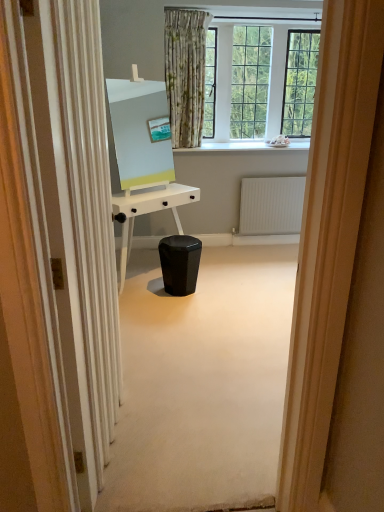
Question: Should I look upward or downward to see white textured radiator at center?

Choices:
 (A) down
 (B) up

Answer: (B)

Question: Is white textured radiator at center completely or partially outside of white glossy desk at center?

Choices:
 (A) no
 (B) yes

Answer: (B)

Question: From a real-world perspective, is white textured radiator at center physically above white glossy desk at center?

Choices:
 (A) yes
 (B) no

Answer: (B)

Question: Is white textured radiator at center facing away from white glossy desk at center?

Choices:
 (A) yes
 (B) no

Answer: (B)

Question: Is white textured radiator at center far from white glossy desk at center?

Choices:
 (A) yes
 (B) no

Answer: (A)

Question: Does white textured radiator at center appear on the right side of white glossy desk at center?

Choices:
 (A) yes
 (B) no

Answer: (A)

Question: Considering the relative sizes of white textured radiator at center and white glossy desk at center in the image provided, is white textured radiator at center smaller than white glossy desk at center?

Choices:
 (A) no
 (B) yes

Answer: (B)

Question: From a real-world perspective, is white textured radiator at center located beneath white glossy screen door at left?

Choices:
 (A) no
 (B) yes

Answer: (B)

Question: Is white textured radiator at center smaller than white glossy screen door at left?

Choices:
 (A) no
 (B) yes

Answer: (B)

Question: Is white textured radiator at center shorter than white glossy screen door at left?

Choices:
 (A) yes
 (B) no

Answer: (A)

Question: From the image's perspective, is white textured radiator at center under white glossy screen door at left?

Choices:
 (A) yes
 (B) no

Answer: (B)

Question: Is white textured radiator at center wider than white glossy screen door at left?

Choices:
 (A) yes
 (B) no

Answer: (B)

Question: Is white textured radiator at center taller than white glossy screen door at left?

Choices:
 (A) no
 (B) yes

Answer: (A)

Question: From a real-world perspective, is black glossy music stool at center beneath white glossy desk at center?

Choices:
 (A) yes
 (B) no

Answer: (A)